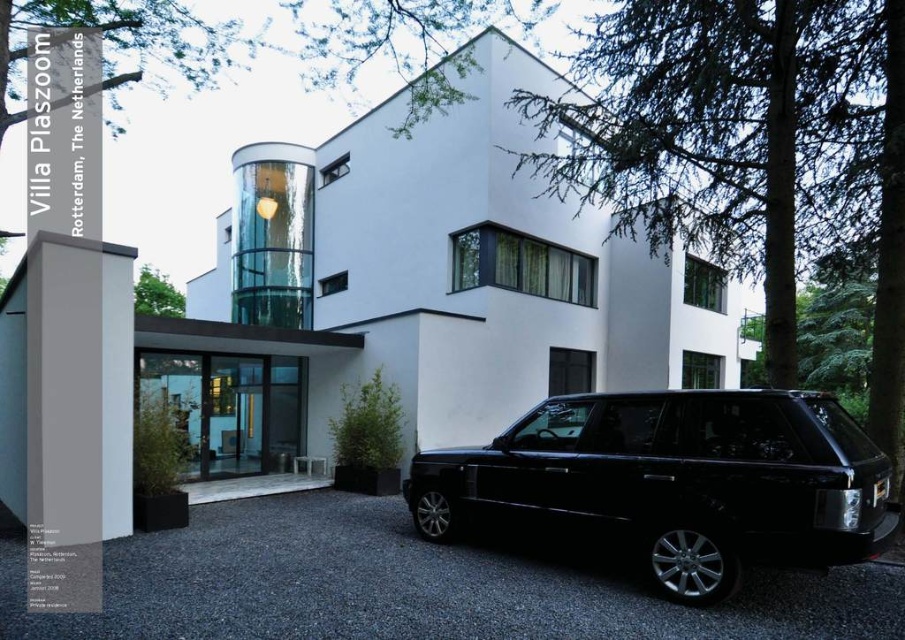
Question: Can you confirm if black asphalt driveway at lower center is positioned above black glossy suv at center?

Choices:
 (A) yes
 (B) no

Answer: (B)

Question: Which point is farther to the camera?

Choices:
 (A) black asphalt driveway at lower center
 (B) black glossy suv at center

Answer: (A)

Question: Which of the following is the farthest from the observer?

Choices:
 (A) (199, 518)
 (B) (759, 556)

Answer: (A)

Question: Can you confirm if black asphalt driveway at lower center is positioned below black glossy suv at center?

Choices:
 (A) yes
 (B) no

Answer: (A)

Question: Does black asphalt driveway at lower center appear on the left side of black glossy suv at center?

Choices:
 (A) yes
 (B) no

Answer: (A)

Question: Which point is closer to the camera taking this photo?

Choices:
 (A) (116, 547)
 (B) (708, 403)

Answer: (B)